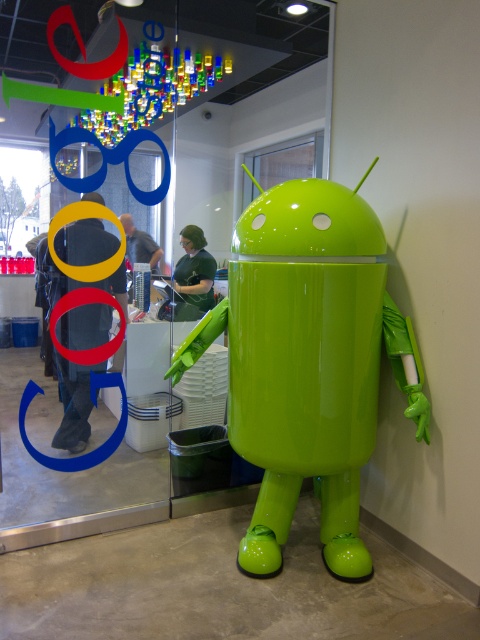
You are a delivery robot with a box that is 34 inches long. You need to navigate through the space between the glossy plastic android at center and the dark gray pants at center. Can your box fit through this space without tilting it sideways?

The distance between the glossy plastic android at center and the dark gray pants at center is 33.93 inches. Since your box is 34 inches long, it is slightly longer than the available space. Therefore, the box cannot fit through the space without tilting it sideways.

You are standing in the Google office and want to touch the green glossy android at center. However, there is a green matte shirt at center in the way. Can you reach the android without moving the shirt?

The green matte shirt at center is closer to you than the green glossy android at center, so you cannot reach the android without moving the shirt.